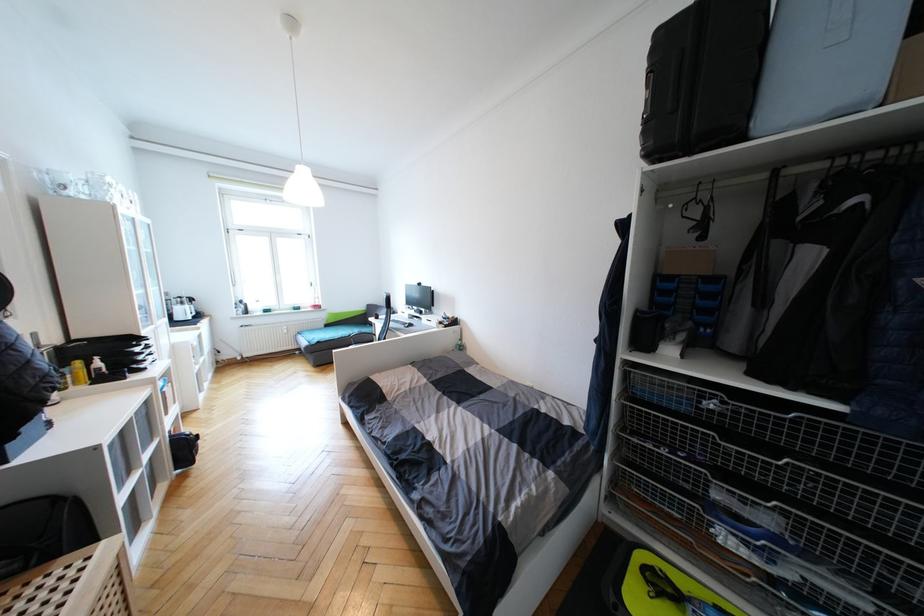
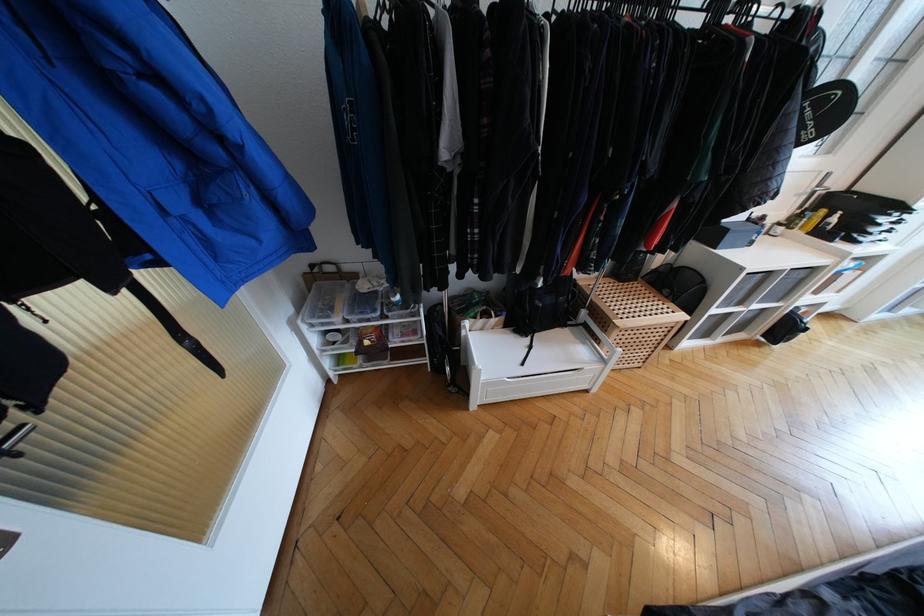
The point at (111, 546) is marked in the first image. Where is the corresponding point in the second image?

(685, 317)